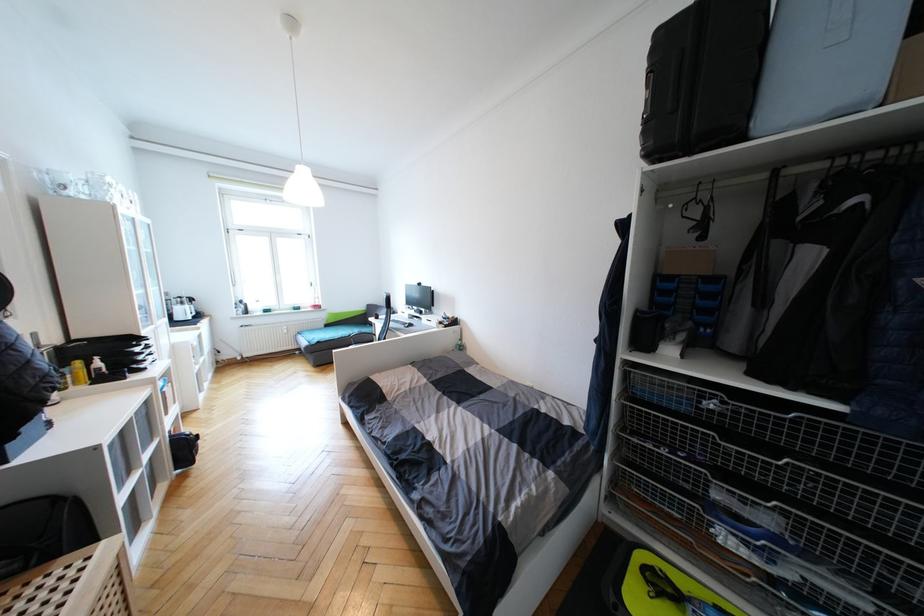
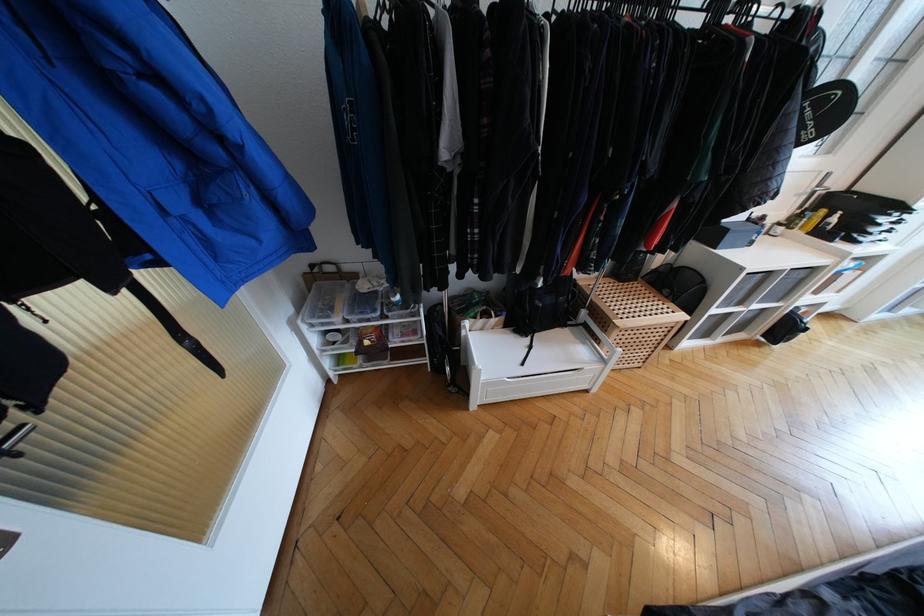
The point at (111, 546) is marked in the first image. Where is the corresponding point in the second image?

(685, 317)